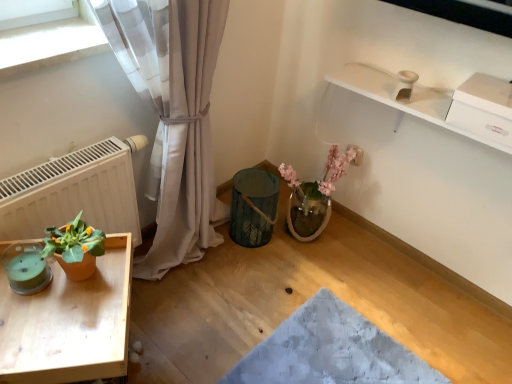
This screenshot has height=384, width=512. I want to click on vacant area located to the right-hand side of terracotta pot at left, so click(116, 286).